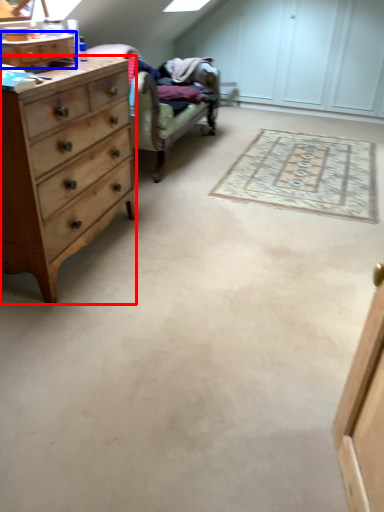
Question: Which object is closer to the camera taking this photo, chest of drawers (highlighted by a red box) or cabinetry (highlighted by a blue box)?

Choices:
 (A) chest of drawers
 (B) cabinetry

Answer: (A)